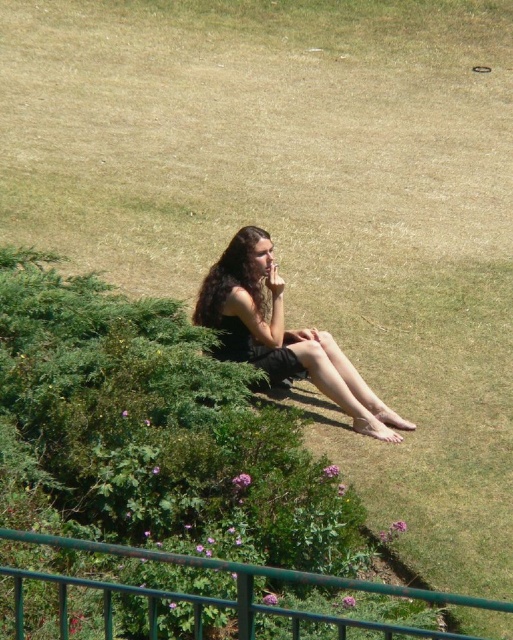
This screenshot has height=640, width=513. I want to click on dark brown hair at center, so click(283, 333).

Which is below, dark brown hair at center or green metal railing at lower center?

green metal railing at lower center

Between point (272, 266) and point (63, 596), which one is positioned behind?

Point (272, 266)

Identify the location of dark brown hair at center. (283, 333).